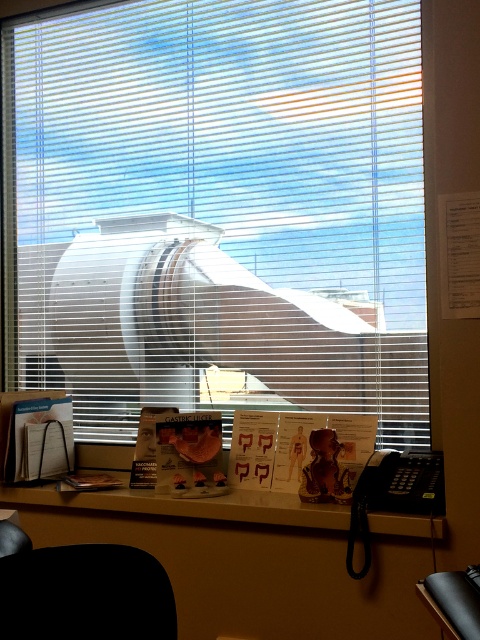
Question: Is white plastic blinds at upper center smaller than white glossy desk at lower center?

Choices:
 (A) yes
 (B) no

Answer: (B)

Question: Does white plastic blinds at upper center appear on the right side of white glossy desk at lower center?

Choices:
 (A) yes
 (B) no

Answer: (B)

Question: Which point appears farthest from the camera in this image?

Choices:
 (A) (83, 193)
 (B) (344, 540)

Answer: (A)

Question: Does white plastic blinds at upper center have a greater width compared to white glossy desk at lower center?

Choices:
 (A) yes
 (B) no

Answer: (A)

Question: Which point is farther to the camera?

Choices:
 (A) white glossy desk at lower center
 (B) white plastic blinds at upper center

Answer: (B)